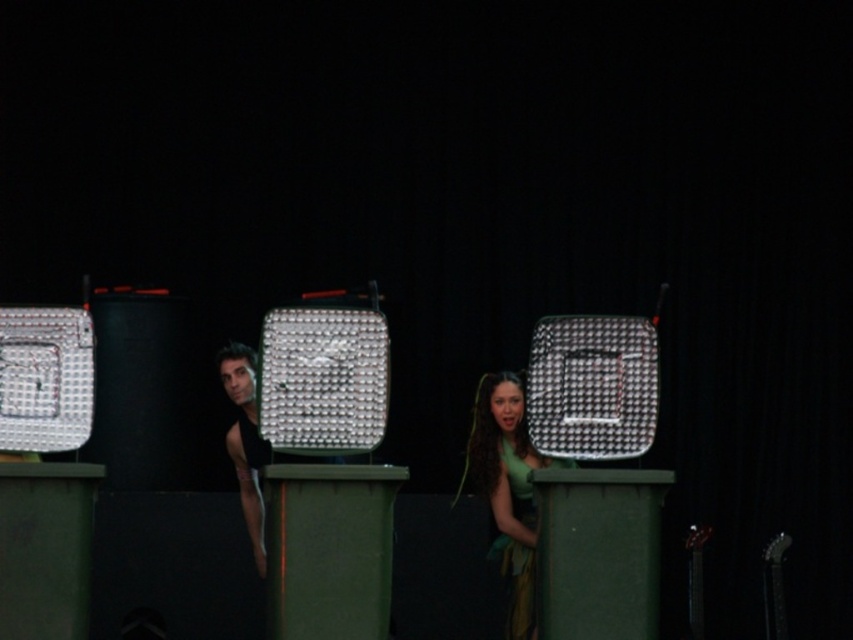
You are a costume designer reviewing a performance scene where the green matte dress at center and the black matte tank top at center are part of the performers attire. Based on the scene description, which clothing item is more prominent in size?

The green matte dress at center is larger in size than the black matte tank top at center, making it more prominent in size.

You are an audience member sitting in the front row of the stage. You notice two performers wearing the green matte dress at center and the black matte tank top at center. Which performer is standing to the right of the other?

The green matte dress at center is positioned on the right side of the black matte tank top at center, so the performer wearing the green matte dress at center is standing to the right of the one in the black matte tank top at center.

Where is the green matte dress at center located in the image?

The green matte dress at center is located at point 0.764 on the x axis and 0.596 on the y axis.